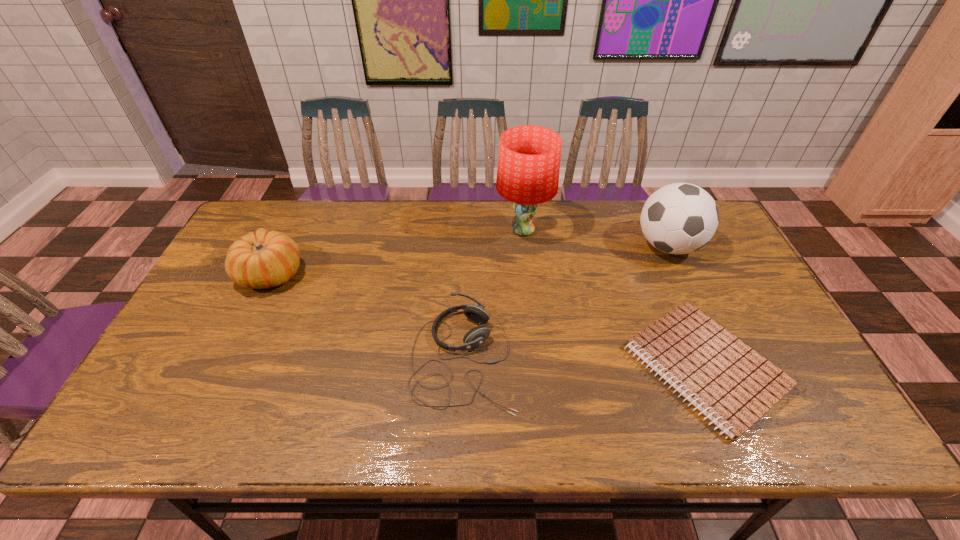
Where is `vacant position located 0.310m on the right of the third tallest object`? The image size is (960, 540). vacant position located 0.310m on the right of the third tallest object is located at coordinates (409, 274).

You are a GUI agent. You are given a task and a screenshot of the screen. Output one action in this format:
    pyautogui.click(x=<x>, y=<y>)
    Task: Click on the free point located 0.120m on the outer surface of the headset
    Image resolution: width=960 pixels, height=540 pixels.
    Given the screenshot: What is the action you would take?
    pyautogui.click(x=563, y=358)

Locate an element on the screen. free space located 0.360m on the left of the notebook is located at coordinates (481, 367).

This screenshot has height=540, width=960. Find the location of `lampshade that is at the far edge`. lampshade that is at the far edge is located at coordinates (529, 158).

The width and height of the screenshot is (960, 540). Find the location of `soccer ball at the far edge`. soccer ball at the far edge is located at coordinates (680, 218).

This screenshot has width=960, height=540. Identify the location of headset located in the near edge section of the desktop. (478, 335).

Find the location of a particular element. notebook located in the near edge section of the desktop is located at coordinates (732, 385).

This screenshot has width=960, height=540. I want to click on object located at the left edge, so click(264, 259).

I want to click on soccer ball that is at the right edge, so click(x=680, y=218).

Where is `notebook that is at the right edge`? The image size is (960, 540). notebook that is at the right edge is located at coordinates (732, 385).